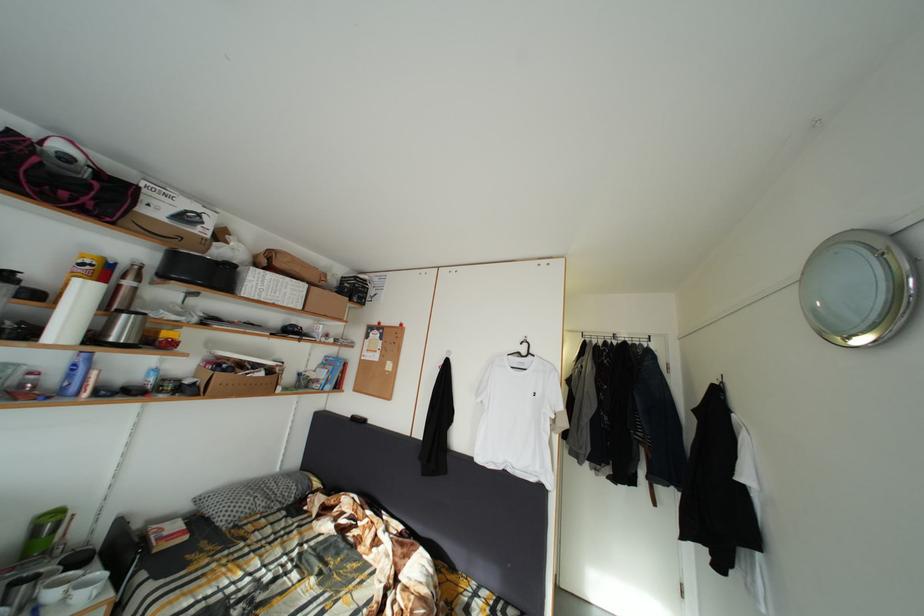
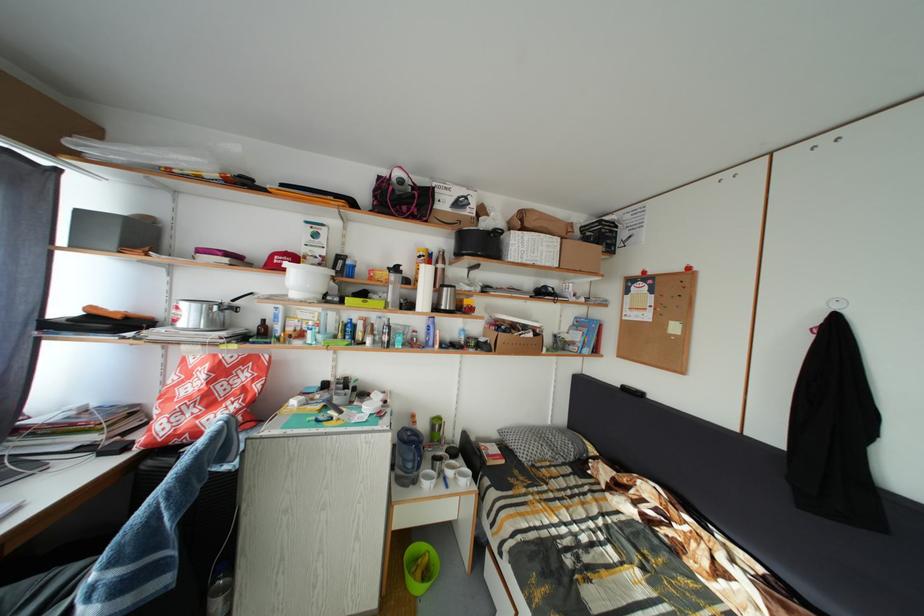
In the second image, find the point that corresponds to [271,379] in the first image.

(540, 341)